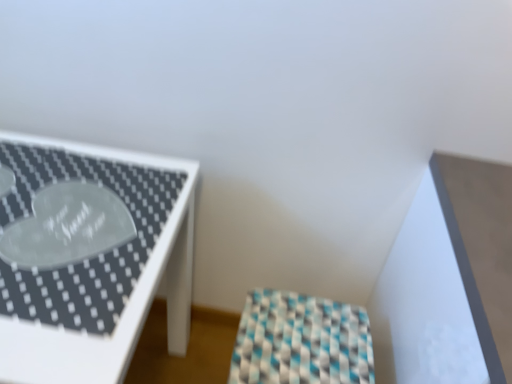
Question: Does white glossy table at left, which appears as the 2th furniture when viewed from the right, have a greater height compared to checkered fabric stool at center, which appears as the second furniture when viewed from the left?

Choices:
 (A) no
 (B) yes

Answer: (B)

Question: Does white glossy table at left, positioned as the 1th furniture in left-to-right order, contain checkered fabric stool at center, which appears as the second furniture when viewed from the left?

Choices:
 (A) yes
 (B) no

Answer: (B)

Question: Does white glossy table at left, positioned as the 1th furniture in left-to-right order, come in front of checkered fabric stool at center, which appears as the second furniture when viewed from the left?

Choices:
 (A) yes
 (B) no

Answer: (A)

Question: From the image's perspective, is white glossy table at left, positioned as the 1th furniture in left-to-right order, beneath checkered fabric stool at center, which is the 1th furniture in right-to-left order?

Choices:
 (A) yes
 (B) no

Answer: (B)

Question: Is white glossy table at left, positioned as the 1th furniture in left-to-right order, outside checkered fabric stool at center, which appears as the second furniture when viewed from the left?

Choices:
 (A) yes
 (B) no

Answer: (A)

Question: Is white glossy table at left, which appears as the 2th furniture when viewed from the right, behind checkered fabric stool at center, which appears as the second furniture when viewed from the left?

Choices:
 (A) yes
 (B) no

Answer: (B)

Question: Is checkered fabric stool at center, which is the 1th furniture in right-to-left order, turned away from white glossy table at left, positioned as the 1th furniture in left-to-right order?

Choices:
 (A) no
 (B) yes

Answer: (A)

Question: Considering the relative sizes of checkered fabric stool at center, which appears as the second furniture when viewed from the left, and white glossy table at left, positioned as the 1th furniture in left-to-right order, in the image provided, is checkered fabric stool at center, which appears as the second furniture when viewed from the left, shorter than white glossy table at left, positioned as the 1th furniture in left-to-right order,?

Choices:
 (A) yes
 (B) no

Answer: (A)

Question: Can you confirm if checkered fabric stool at center, which appears as the second furniture when viewed from the left, is positioned to the right of white glossy table at left, which appears as the 2th furniture when viewed from the right?

Choices:
 (A) yes
 (B) no

Answer: (A)

Question: Is checkered fabric stool at center, which is the 1th furniture in right-to-left order, oriented towards white glossy table at left, positioned as the 1th furniture in left-to-right order?

Choices:
 (A) no
 (B) yes

Answer: (B)

Question: Is checkered fabric stool at center, which is the 1th furniture in right-to-left order, wider than white glossy table at left, positioned as the 1th furniture in left-to-right order?

Choices:
 (A) no
 (B) yes

Answer: (A)

Question: Is checkered fabric stool at center, which is the 1th furniture in right-to-left order, far away from white glossy table at left, positioned as the 1th furniture in left-to-right order?

Choices:
 (A) no
 (B) yes

Answer: (A)

Question: Is checkered fabric stool at center, which is the 1th furniture in right-to-left order, in front of or behind white glossy table at left, which appears as the 2th furniture when viewed from the right, in the image?

Choices:
 (A) behind
 (B) front

Answer: (A)